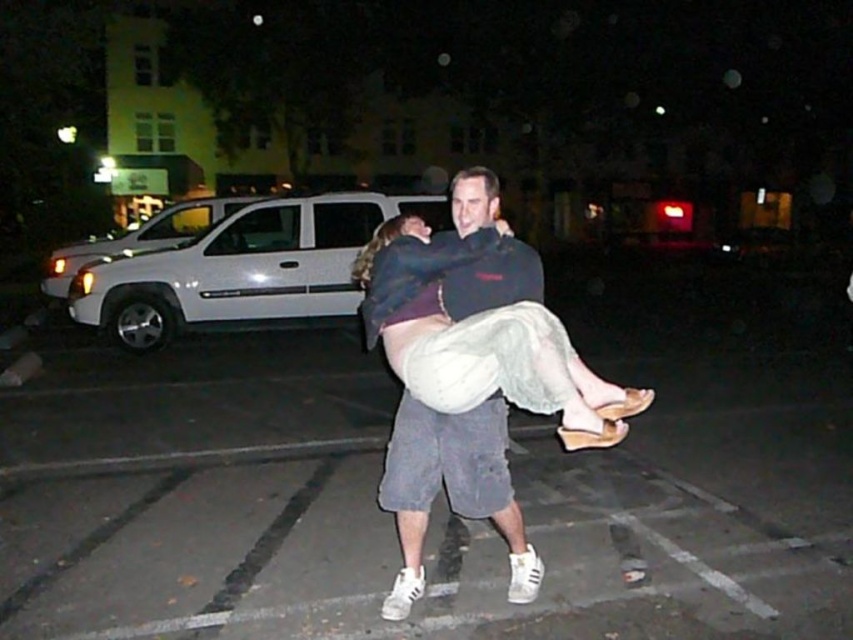
Is gray asphalt parking lot at center further to camera compared to white matte van at center?

No, it is not.

Between gray asphalt parking lot at center and white matte van at center, which one is positioned lower?

gray asphalt parking lot at center is below.

Who is more distant from viewer, (x=45, y=570) or (x=431, y=218)?

Positioned behind is point (x=431, y=218).

Locate an element on the screen. gray asphalt parking lot at center is located at coordinates tap(433, 504).

Does white matte van at center come in front of white matte suv at left?

Yes.

Can you confirm if white matte van at center is bigger than white matte suv at left?

No, white matte van at center is not bigger than white matte suv at left.

Is point (344, 291) behind point (192, 216)?

No, it is in front of (192, 216).

Identify the location of white matte van at center. (242, 268).

Based on the photo, does gray asphalt parking lot at center appear on the left side of white matte suv at left?

No, gray asphalt parking lot at center is not to the left of white matte suv at left.

Is gray asphalt parking lot at center above white matte suv at left?

No, gray asphalt parking lot at center is not above white matte suv at left.

Who is more forward, (152,480) or (99,246)?

Point (152,480) is in front.

You are a GUI agent. You are given a task and a screenshot of the screen. Output one action in this format:
    pyautogui.click(x=<x>, y=<y>)
    Task: Click on the gray asphalt parking lot at center
    The height and width of the screenshot is (640, 853).
    Given the screenshot: What is the action you would take?
    pyautogui.click(x=433, y=504)